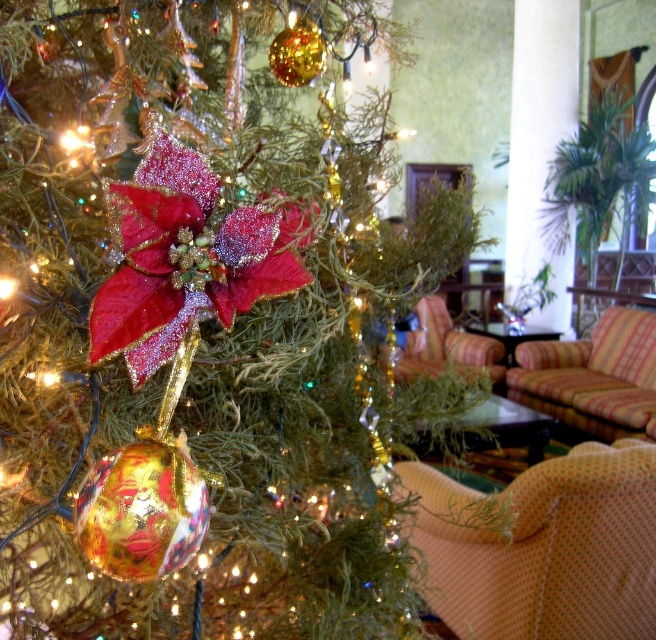
Question: Is green leafy plant at upper right positioned in front of plaid fabric armchair at right?

Choices:
 (A) yes
 (B) no

Answer: (B)

Question: Is shiny metallic ball at center in front of plaid fabric armchair at right?

Choices:
 (A) no
 (B) yes

Answer: (B)

Question: Which point is closer to the camera taking this photo?

Choices:
 (A) (459, 632)
 (B) (544, 184)

Answer: (A)

Question: Can you confirm if shiny velvet poinsettia at center is positioned to the right of plaid fabric armchair at right?

Choices:
 (A) no
 (B) yes

Answer: (A)

Question: Estimate the real-world distances between objects in this image. Which object is farther from the striped fabric armchair at right?

Choices:
 (A) plaid fabric armchair at right
 (B) shiny metallic ball at center

Answer: (B)

Question: Which object is closer to the camera taking this photo?

Choices:
 (A) orange dotted fabric armchair at lower right
 (B) shiny velvet poinsettia at center
 (C) shiny metallic ball at center
 (D) plaid fabric armchair at right

Answer: (C)